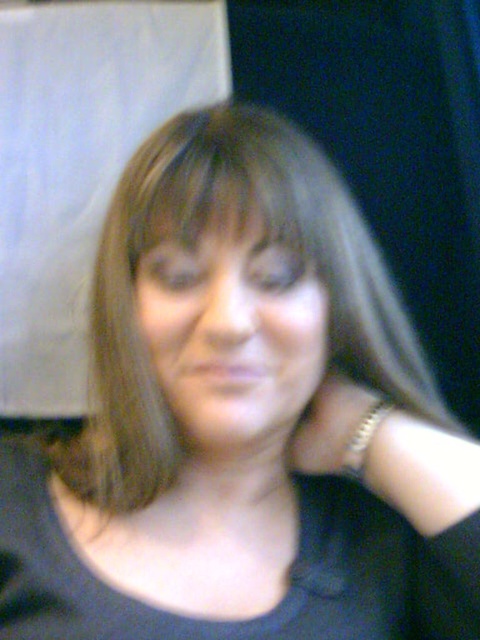
Is point (215, 394) positioned before point (357, 449)?

Yes.

The height and width of the screenshot is (640, 480). What do you see at coordinates (231, 330) in the screenshot? I see `smooth skin face at center` at bounding box center [231, 330].

Find the location of a particular element. This screenshot has height=640, width=480. smooth skin face at center is located at coordinates point(231,330).

The width and height of the screenshot is (480, 640). Find the location of `smooth skin face at center`. smooth skin face at center is located at coordinates (231, 330).

Who is more distant from viewer, (x=319, y=465) or (x=374, y=412)?

The point (x=319, y=465) is behind.

The image size is (480, 640). What are the coordinates of `gold metallic bracelet at neck` in the screenshot? It's located at (336, 428).

Between point (327, 456) and point (361, 451), which one is positioned behind?

The point (327, 456) is more distant.

Find the location of a particular element. gold metallic bracelet at neck is located at coordinates (336, 428).

Does smooth skin face at center have a lesser width compared to gold metallic bracelet at neck?

Incorrect, smooth skin face at center's width is not less than gold metallic bracelet at neck's.

Can you confirm if smooth skin face at center is smaller than gold metallic bracelet at neck?

Actually, smooth skin face at center might be larger than gold metallic bracelet at neck.

The height and width of the screenshot is (640, 480). I want to click on smooth skin face at center, so click(x=231, y=330).

Locate an element on the screen. smooth skin face at center is located at coordinates (231, 330).